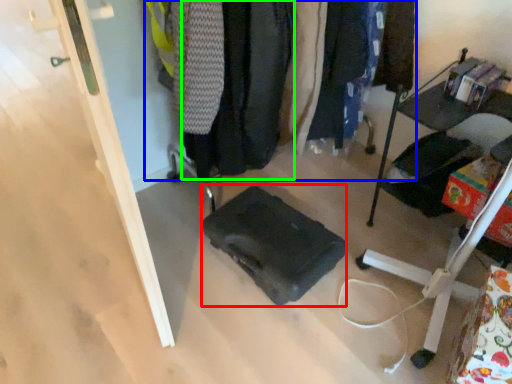
Question: Which object is positioned farthest from luggage (highlighted by a red box)? Select from closet (highlighted by a blue box) and clothing (highlighted by a green box).

Choices:
 (A) closet
 (B) clothing

Answer: (A)